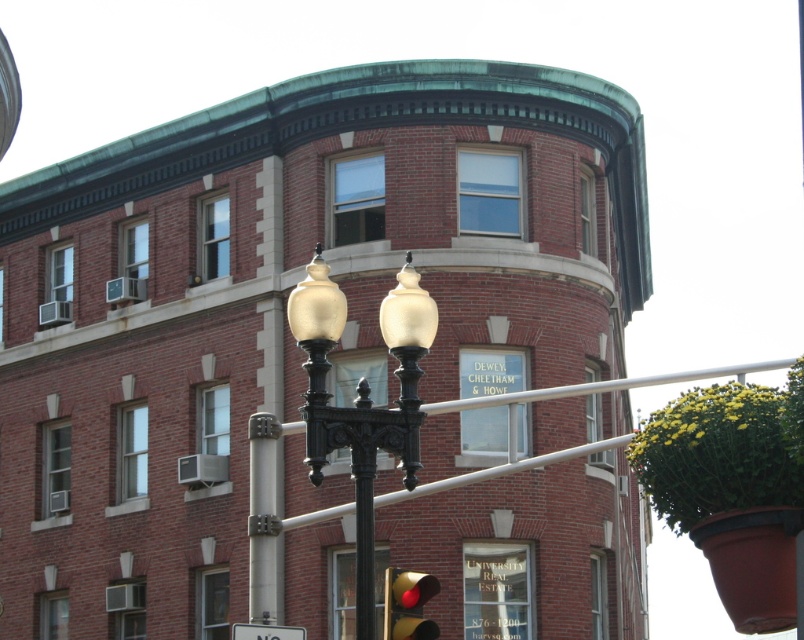
Question: Which object appears farthest from the camera in this image?

Choices:
 (A) matte gold streetlight at center
 (B) matte red traffic light at lower center
 (C) white plastic sign at lower center

Answer: (C)

Question: Can you confirm if matte red traffic light at lower center is smaller than white plastic sign at lower center?

Choices:
 (A) no
 (B) yes

Answer: (B)

Question: From the image, what is the correct spatial relationship of matte gold streetlight at center in relation to white plastic sign at lower center?

Choices:
 (A) above
 (B) below

Answer: (A)

Question: Which object is the closest to the matte gold streetlight at center?

Choices:
 (A) matte red traffic light at lower center
 (B) white plastic sign at lower center

Answer: (A)

Question: Can you confirm if matte gold streetlight at center is positioned below white plastic sign at lower center?

Choices:
 (A) no
 (B) yes

Answer: (A)

Question: Among these points, which one is nearest to the camera?

Choices:
 (A) (279, 625)
 (B) (409, 572)
 (C) (374, 426)

Answer: (C)